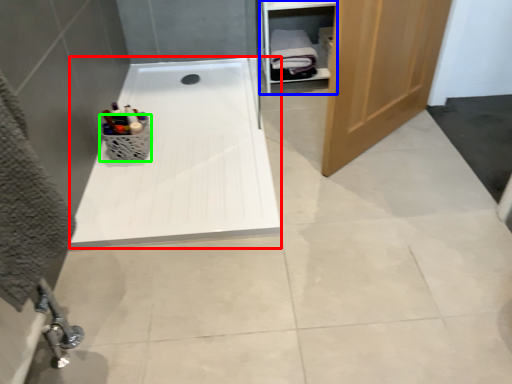
Question: Considering the real-world distances, which object is farthest from bath (highlighted by a red box)? cabinet (highlighted by a blue box) or basket (highlighted by a green box)?

Choices:
 (A) cabinet
 (B) basket

Answer: (A)